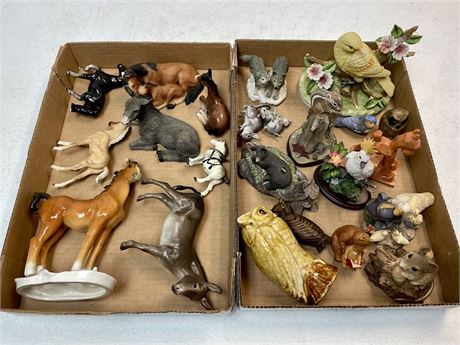
This screenshot has height=345, width=460. Find the location of `mouse`. mouse is located at coordinates (409, 271).